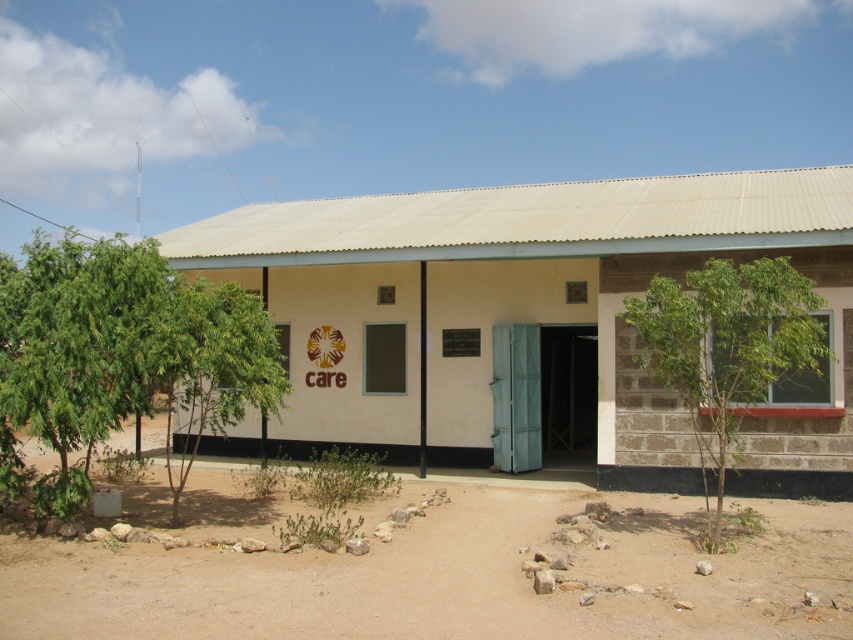
You are standing in front of the building and want to walk from the brown sandy dirt at lower center to the green leafy tree at right. Which direction should you move relative to the building?

You should move to the right relative to the building because the brown sandy dirt at lower center is to the left of the green leafy tree at right.

You are standing at the entrance of the building and want to find the green leafy tree at lower left. Based on the 2D coordinates provided, in which direction should you look to see it?

The green leafy tree at lower left is located at point 0.545 on the x axis and 0.150 on the y axis. Since the coordinates are lower left, you should look to your lower left direction to see it.

You are standing in front of the building and want to walk towards the green leafy tree at lower left. Which direction should you turn to avoid the green leafy tree at right?

The green leafy tree at lower left is to the left of green leafy tree at right. So you should turn left to avoid the green leafy tree at right and head towards the green leafy tree at lower left.